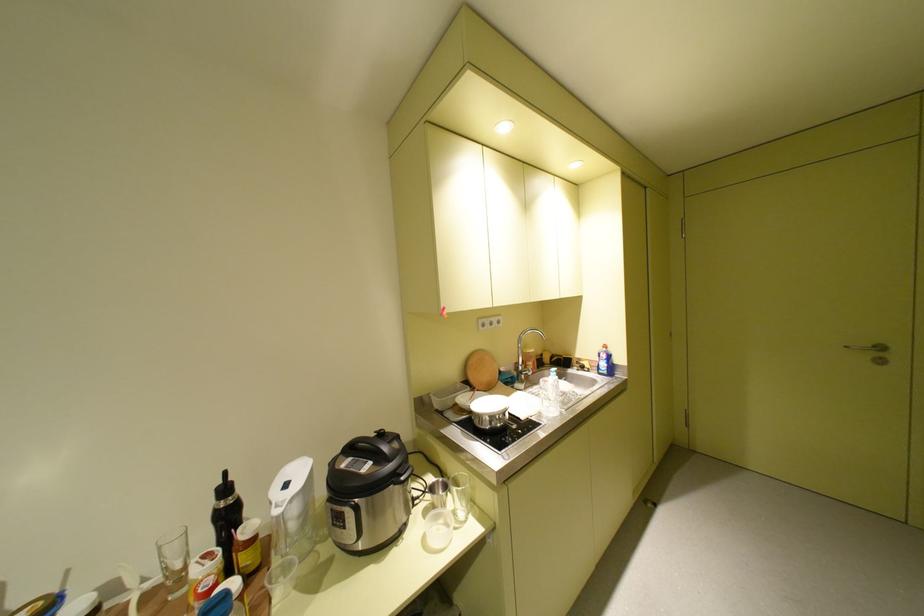
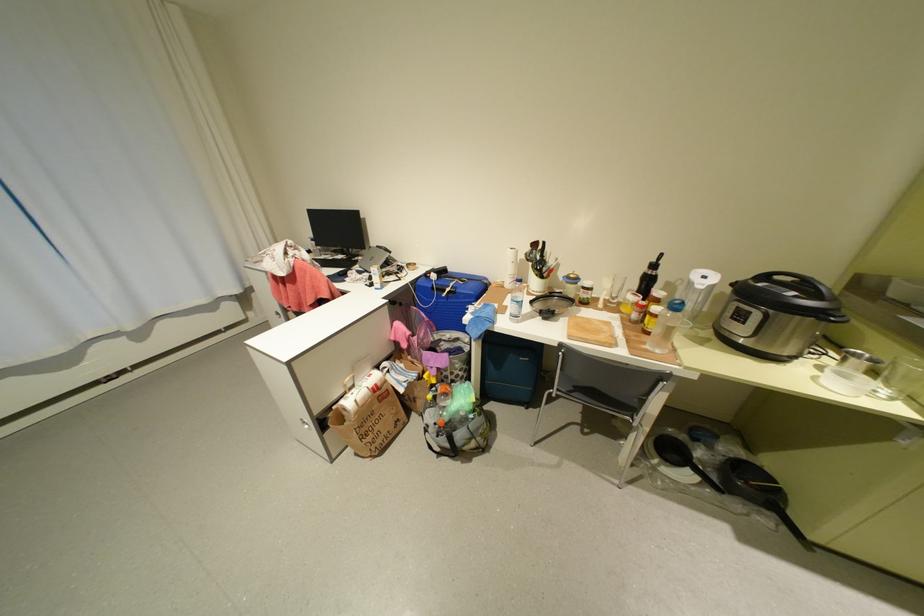
In the second image, find the point that corresponds to pixel 472 515 in the first image.

(897, 392)